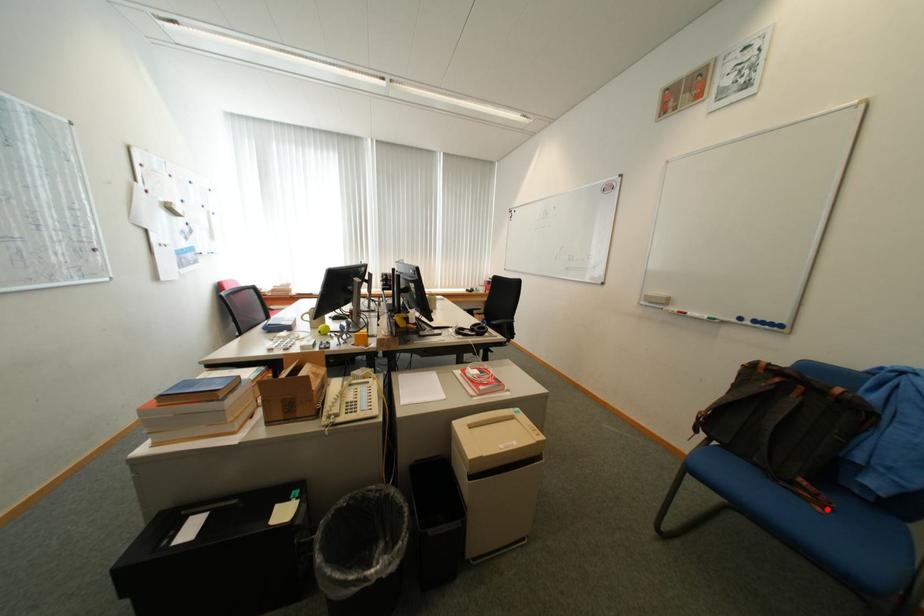
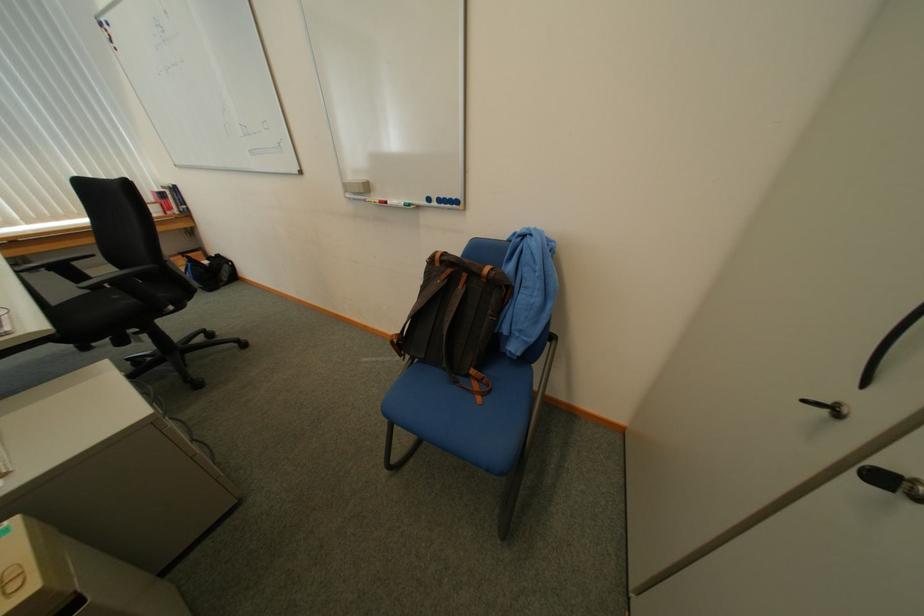
Find the pixel in the second image that matches the highlighted location in the first image.

(489, 400)